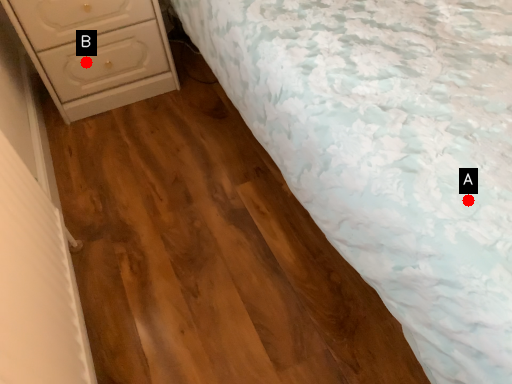
Question: Two points are circled on the image, labeled by A and B beside each circle. Which point is farther from the camera taking this photo?

Choices:
 (A) A is further
 (B) B is further

Answer: (B)